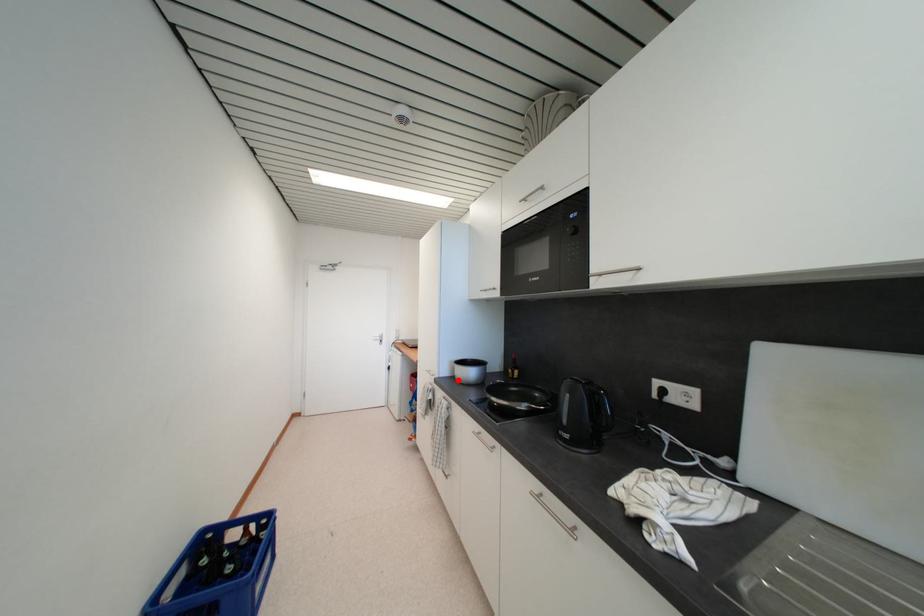
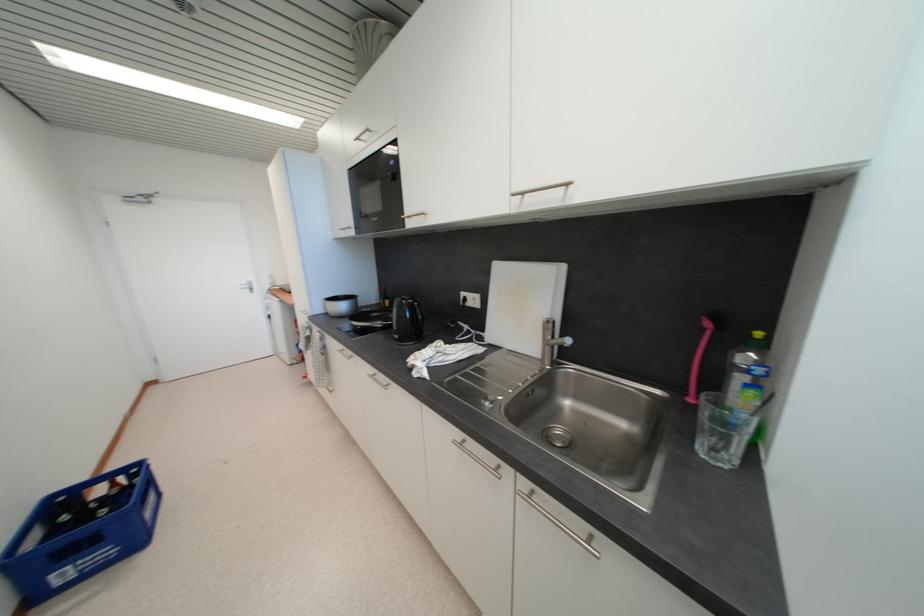
In the second image, find the point that corresponds to the highlighted location in the first image.

(332, 315)